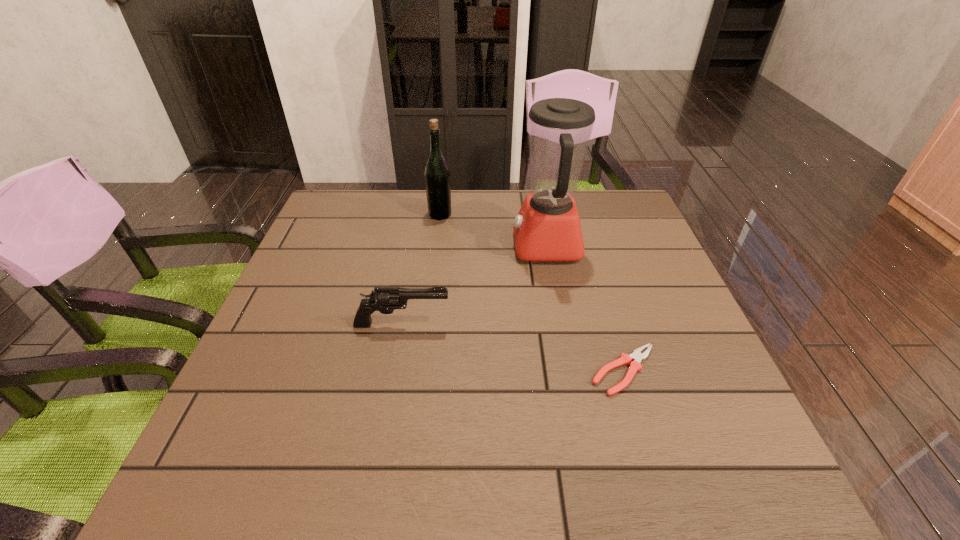
Find the location of `object that stands as the closest to the nearest object`. object that stands as the closest to the nearest object is located at coordinates (547, 228).

Find the location of a particular element. The height and width of the screenshot is (540, 960). object that is the third closest one to the gun is located at coordinates (437, 176).

The width and height of the screenshot is (960, 540). In order to click on vacant space that satisfies the following two spatial constraints: 1. at the end of the barrel of the shortest object; 2. on the left side of the second nearest object in this screenshot , I will do `click(394, 370)`.

The height and width of the screenshot is (540, 960). I want to click on free space that satisfies the following two spatial constraints: 1. on the back side of the pliers; 2. on the front of the blender near the controls, so click(x=587, y=246).

You are a GUI agent. You are given a task and a screenshot of the screen. Output one action in this format:
    pyautogui.click(x=<x>, y=<y>)
    Task: Click on the vacant area in the image that satisfies the following two spatial constraints: 1. on the front of the tallest object near the controls; 2. on the right side of the nearest object
    This screenshot has width=960, height=540.
    Given the screenshot: What is the action you would take?
    pyautogui.click(x=570, y=370)

I want to click on free space that satisfies the following two spatial constraints: 1. on the front of the tallest object near the controls; 2. on the left side of the shortest object, so click(x=570, y=370).

Find the location of a particular element. The width and height of the screenshot is (960, 540). vacant space that satisfies the following two spatial constraints: 1. on the back side of the shortest object; 2. on the front of the second farthest object near the controls is located at coordinates (587, 246).

You are a GUI agent. You are given a task and a screenshot of the screen. Output one action in this format:
    pyautogui.click(x=<x>, y=<y>)
    Task: Click on the free space that satisfies the following two spatial constraints: 1. on the front of the blender near the controls; 2. on the right side of the nearest object
    This screenshot has width=960, height=540.
    Given the screenshot: What is the action you would take?
    coord(570,370)